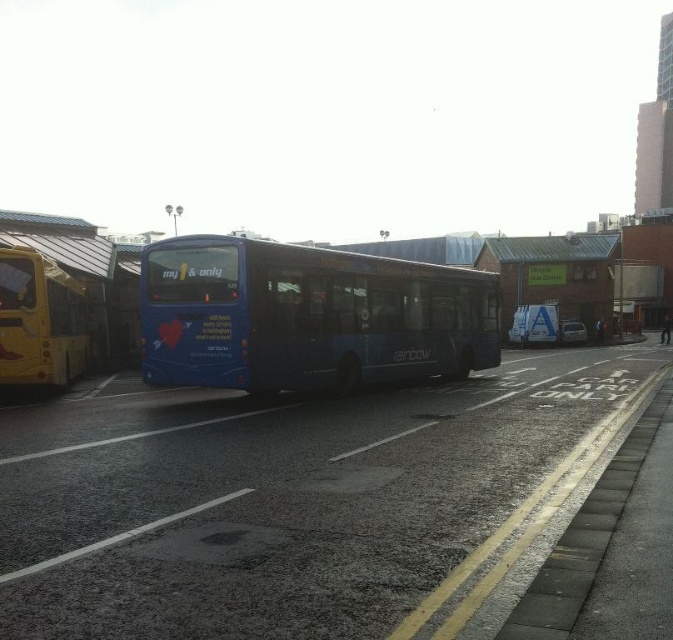
Question: In this image, where is blue matte bus at center located relative to yellow metallic bus at left?

Choices:
 (A) below
 (B) above

Answer: (B)

Question: Among these points, which one is farthest from the camera?

Choices:
 (A) (481, 355)
 (B) (3, 278)

Answer: (A)

Question: Which of the following is the closest to the observer?

Choices:
 (A) blue matte bus at center
 (B) yellow metallic bus at left

Answer: (A)

Question: Does blue matte bus at center come behind yellow metallic bus at left?

Choices:
 (A) yes
 (B) no

Answer: (B)

Question: Does blue matte bus at center appear under yellow metallic bus at left?

Choices:
 (A) yes
 (B) no

Answer: (B)